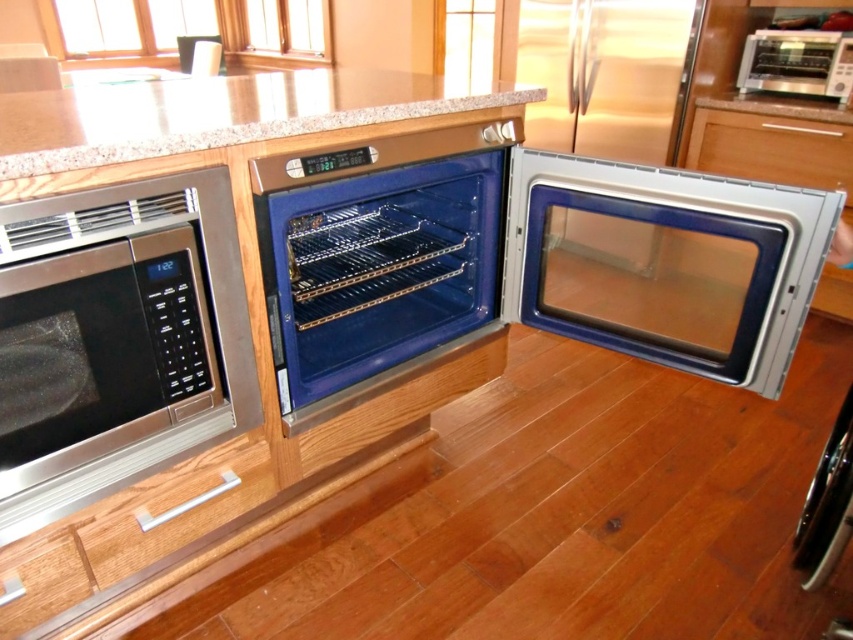
Question: Which point is closer to the camera?

Choices:
 (A) (161, 497)
 (B) (722, 134)

Answer: (A)

Question: Does satin wood drawer at center appear on the left side of satin silver toaster oven at upper right?

Choices:
 (A) no
 (B) yes

Answer: (B)

Question: Where is granite at upper center located in relation to satin wood drawer at center in the image?

Choices:
 (A) below
 (B) above

Answer: (A)

Question: Is the position of granite at upper center less distant than that of satin stainless steel refrigerator at center?

Choices:
 (A) no
 (B) yes

Answer: (B)

Question: Among these points, which one is nearest to the camera?

Choices:
 (A) (137, 145)
 (B) (107, 500)
 (C) (599, 269)

Answer: (A)

Question: Which point is farther to the camera?

Choices:
 (A) white wood drawer at lower center
 (B) satin silver oven at center
 (C) granite at upper center

Answer: (B)